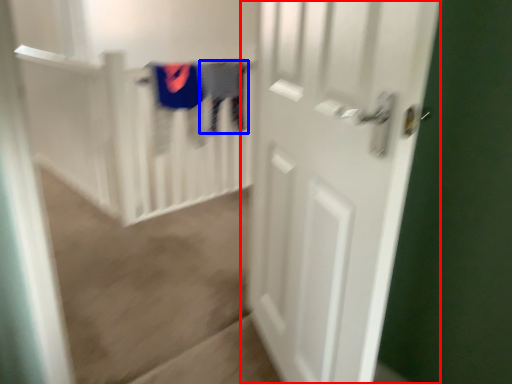
Question: Which object is closer to the camera taking this photo, door (highlighted by a red box) or clothing (highlighted by a blue box)?

Choices:
 (A) door
 (B) clothing

Answer: (A)